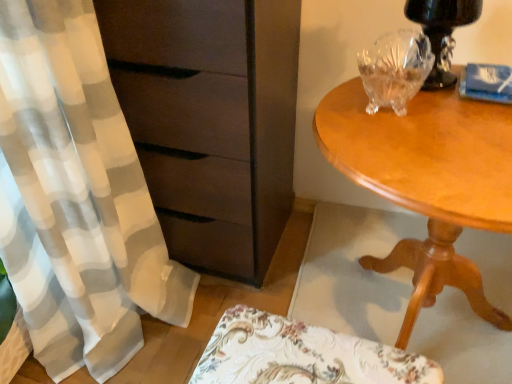
Where is `free space in front of transparent crystal bowl at upper right`? free space in front of transparent crystal bowl at upper right is located at coordinates (423, 154).